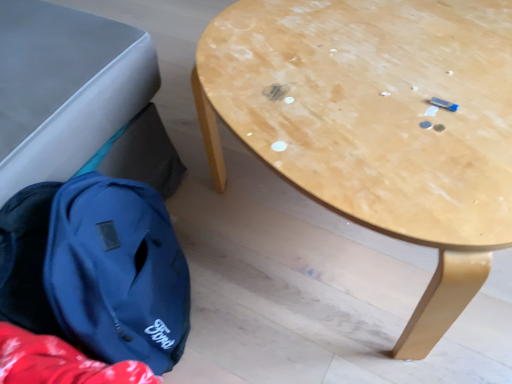
Question: Should I look upward or downward to see light brown wood table at center?

Choices:
 (A) down
 (B) up

Answer: (B)

Question: From a real-world perspective, is light brown wood table at center positioned under matte blue backpack at lower left based on gravity?

Choices:
 (A) no
 (B) yes

Answer: (A)

Question: Is light brown wood table at center not near matte blue backpack at lower left?

Choices:
 (A) yes
 (B) no

Answer: (B)

Question: Is light brown wood table at center located outside matte blue backpack at lower left?

Choices:
 (A) yes
 (B) no

Answer: (A)

Question: Is light brown wood table at center next to matte blue backpack at lower left?

Choices:
 (A) yes
 (B) no

Answer: (B)

Question: Does light brown wood table at center come behind matte blue backpack at lower left?

Choices:
 (A) yes
 (B) no

Answer: (B)

Question: Is light brown wood table at center smaller than matte blue backpack at lower left?

Choices:
 (A) yes
 (B) no

Answer: (B)

Question: Is matte blue backpack at lower left shorter than light brown wood table at center?

Choices:
 (A) yes
 (B) no

Answer: (A)

Question: Is matte blue backpack at lower left bigger than light brown wood table at center?

Choices:
 (A) no
 (B) yes

Answer: (A)

Question: Can you confirm if matte blue backpack at lower left is thinner than light brown wood table at center?

Choices:
 (A) yes
 (B) no

Answer: (A)

Question: Can you confirm if matte blue backpack at lower left is positioned to the left of light brown wood table at center?

Choices:
 (A) yes
 (B) no

Answer: (A)

Question: Is light brown wood table at center located within matte blue backpack at lower left?

Choices:
 (A) no
 (B) yes

Answer: (A)

Question: Could you tell me if matte blue backpack at lower left is facing light brown wood table at center?

Choices:
 (A) yes
 (B) no

Answer: (A)

Question: Choose the correct answer: Is light brown wood table at center inside matte blue backpack at lower left or outside it?

Choices:
 (A) inside
 (B) outside

Answer: (B)